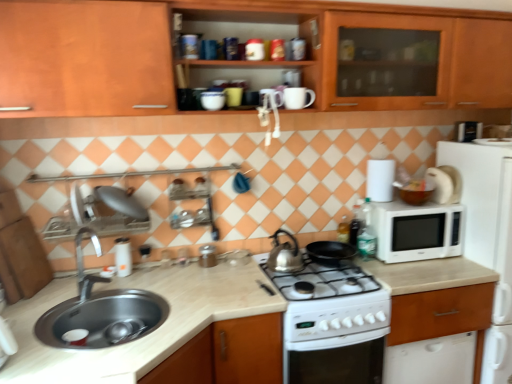
This screenshot has height=384, width=512. I want to click on free point below satin silver kettle at center (from a real-world perspective), so click(282, 260).